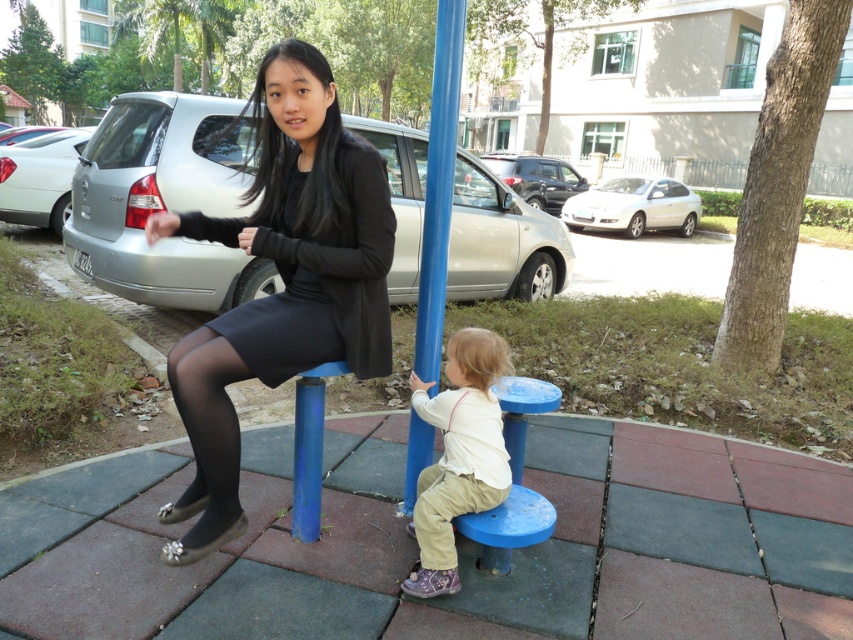
Who is more distant from viewer, (207, 531) or (445, 224)?

The point (445, 224) is behind.

Who is positioned more to the right, matte black dress at center or blue plastic pole at center?

blue plastic pole at center is more to the right.

Who is more distant from viewer, (328, 221) or (451, 20)?

Positioned behind is point (451, 20).

At what (x,y) coordinates should I click in order to perform the action: click on matte black dress at center. Please return your answer as a coordinate pair (x, y). Image resolution: width=853 pixels, height=640 pixels. Looking at the image, I should click on (282, 280).

Which is above, matte black dress at center or black matte dress at center?

Positioned higher is black matte dress at center.

What do you see at coordinates (282, 280) in the screenshot? This screenshot has width=853, height=640. I see `matte black dress at center` at bounding box center [282, 280].

Is point (212, 445) positioned after point (311, 280)?

No, (212, 445) is closer to viewer.

I want to click on matte black dress at center, so click(x=282, y=280).

Can you confirm if black matte dress at center is smaller than light beige cotton pants at lower center?

No.

Which of these two, black matte dress at center or light beige cotton pants at lower center, stands taller?

light beige cotton pants at lower center

Is point (343, 234) more distant than point (450, 483)?

That is False.

Find the location of a particular element. The height and width of the screenshot is (640, 853). black matte dress at center is located at coordinates (315, 272).